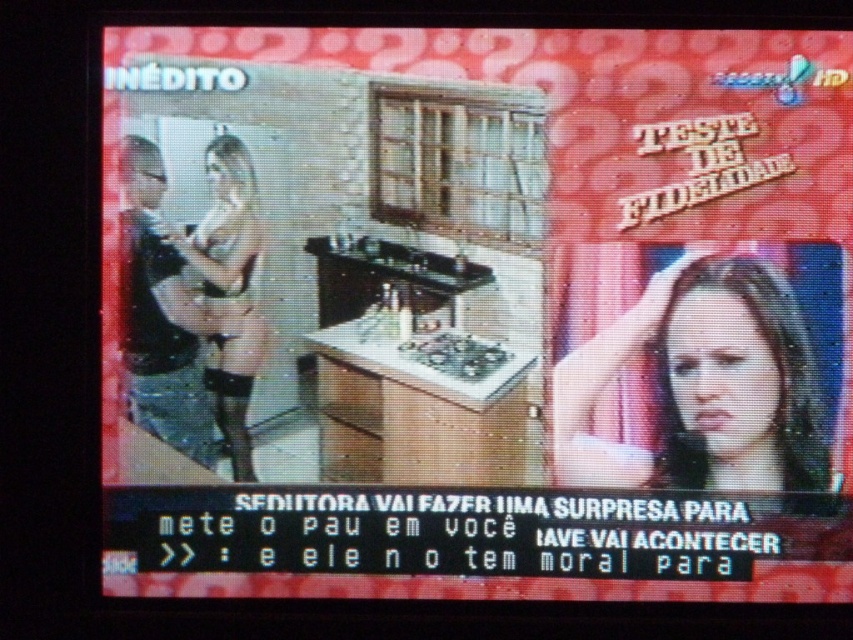
Question: Does smooth brown hair at right have a smaller size compared to matte black lingerie at left?

Choices:
 (A) yes
 (B) no

Answer: (B)

Question: Can you confirm if smooth brown hair at right is positioned below matte black lingerie at left?

Choices:
 (A) no
 (B) yes

Answer: (B)

Question: Which point is farther from the camera taking this photo?

Choices:
 (A) (669, 435)
 (B) (202, 358)

Answer: (B)

Question: Is smooth brown hair at right bigger than matte black lingerie at left?

Choices:
 (A) no
 (B) yes

Answer: (B)

Question: Which object is closer to the camera taking this photo?

Choices:
 (A) matte black lingerie at left
 (B) smooth brown hair at right

Answer: (B)